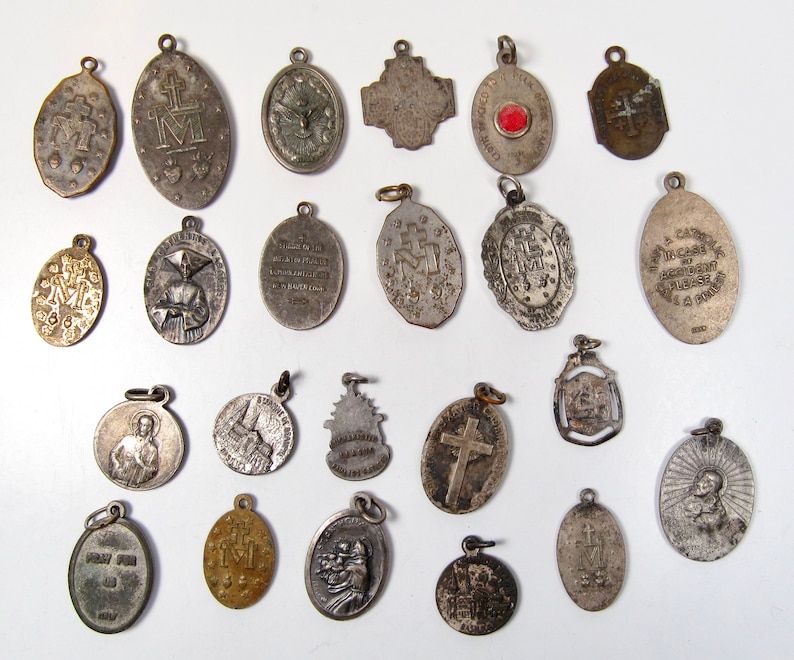
Image resolution: width=794 pixels, height=660 pixels. In order to click on medals on second row from top in this screenshot , I will do `click(58, 308)`, `click(179, 280)`, `click(291, 261)`, `click(410, 265)`, `click(526, 273)`, `click(692, 257)`.